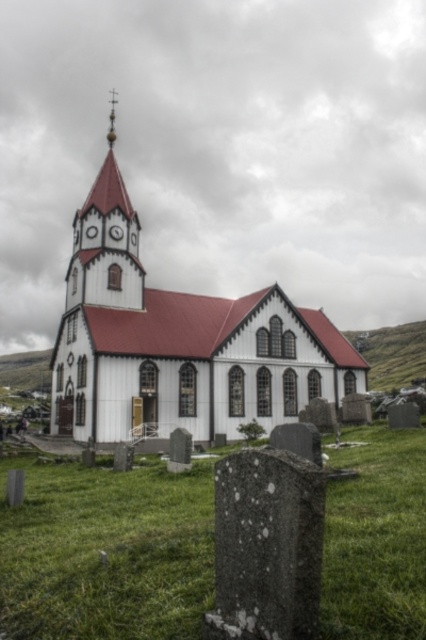
You are standing at the entrance of the church and want to walk towards the steeple. There are two points marked on the ground in front of you at coordinates point (322, 356) and point (114, 115). Which point will you reach first?

You will reach point (322, 356) first because it is in front of point (114, 115) along the path towards the steeple.

You are standing at the entrance of the white wood church at center and want to place a flower on the granite gravestone at lower center. In which direction should you move relative to the church?

The granite gravestone at lower center is located below the white wood church at center, so you should move downward towards the granite gravestone at lower center.

You are standing at the entrance of the traditional church and want to take a photo of the point at coordinates point (45, 536). The camera you have can focus on objects up to 40 meters away. Will the point be in focus?

The point (45, 536) is 40.84 meters away from the camera, which is beyond the camera focus range of 40 meters. Therefore, the point will not be in focus.